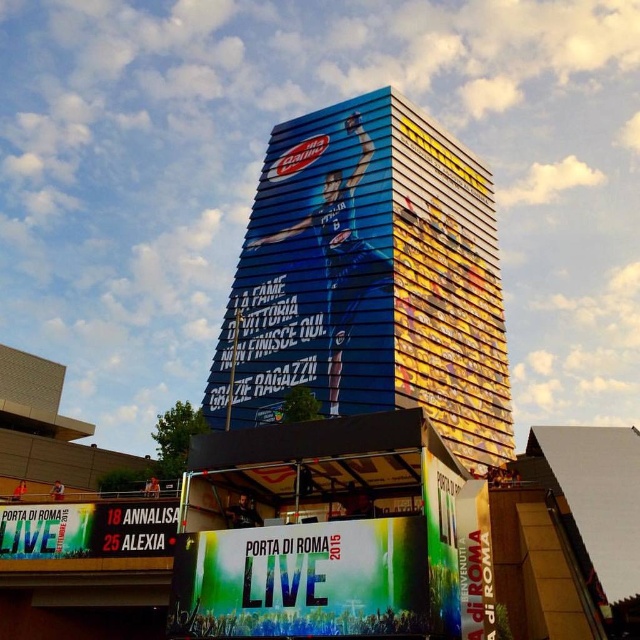
You are a delivery person who needs to place a new banner exactly 3 meters away from the white plastic scoreboard at center. Can you place the green fabric banner at center in the current space?

The distance between the green fabric banner at center and the white plastic scoreboard at center is 2.59 meters. Since the required distance is 3 meters, the banner is placed too close to the scoreboard. You need to move it further away by 0.41 meters to meet the requirement.

You are standing in front of the tall building with the blue facade. You notice two points marked on the advertisement. The first point is at coordinates point (x=58, y=548) and the second is at point (x=144, y=534). From your perspective, which point appears closer to you?

Point (x=144, y=534) appears closer because it is in front of point (x=58, y=548), which is behind it.

You are planning to install a new light pole between the green fabric banner at lower center and the white plastic scoreboard at center. The light pole requires a minimum of 10 meters of space between them to ensure proper installation. Can the light pole be placed between these two objects?

The green fabric banner at lower center and white plastic scoreboard at center are 11.35 meters apart from each other, which is more than the required 10 meters. Therefore, the light pole can be placed between them with sufficient space.